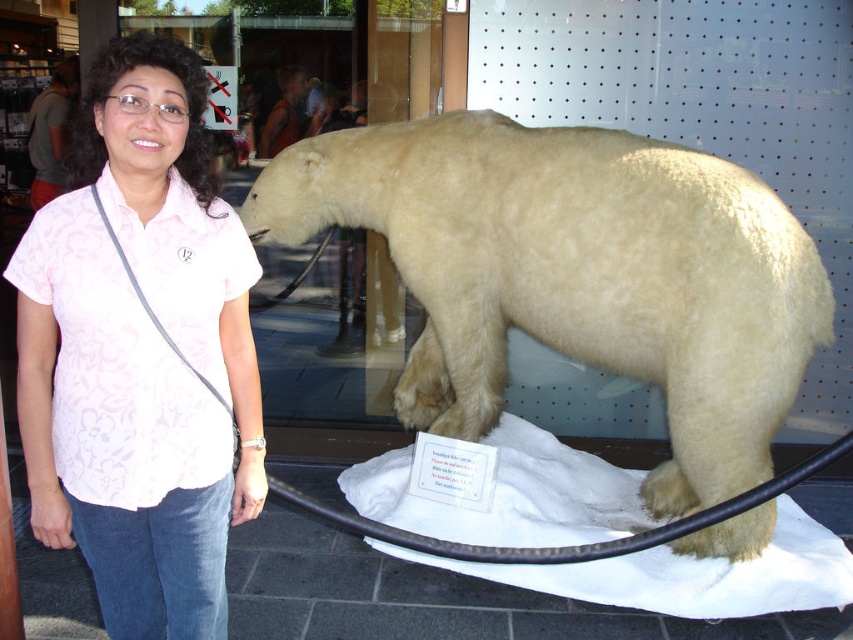
Question: Can you confirm if white fur polar bear at center is positioned to the left of pink floral shirt at center?

Choices:
 (A) yes
 (B) no

Answer: (B)

Question: Which point appears farthest from the camera in this image?

Choices:
 (A) (155, 582)
 (B) (746, 205)

Answer: (B)

Question: Which of the following is the farthest from the observer?

Choices:
 (A) pink floral shirt at center
 (B) white fur polar bear at center

Answer: (B)

Question: Does white fur polar bear at center have a lesser width compared to pink floral shirt at center?

Choices:
 (A) no
 (B) yes

Answer: (A)

Question: Can you confirm if white fur polar bear at center is positioned below pink floral shirt at center?

Choices:
 (A) yes
 (B) no

Answer: (B)